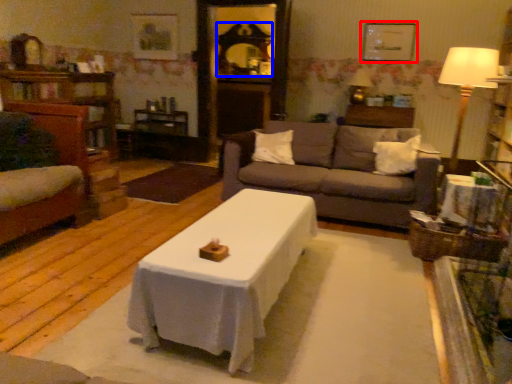
Question: Which of the following is the farthest to the observer, picture frame (highlighted by a red box) or mirror (highlighted by a blue box)?

Choices:
 (A) picture frame
 (B) mirror

Answer: (B)